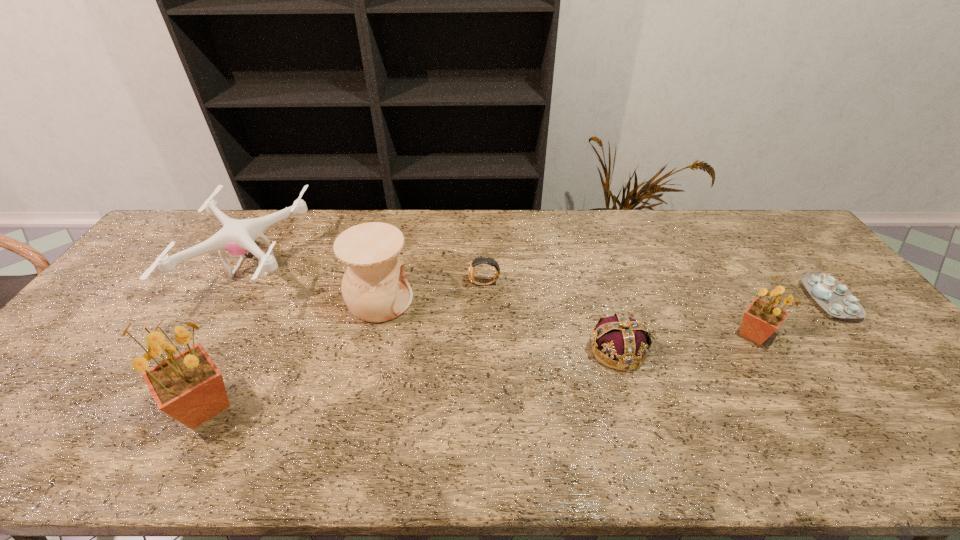
Image resolution: width=960 pixels, height=540 pixels. Identify the location of the fourth object from left to right. (480, 282).

Identify the location of the sixth tallest object. (480, 282).

Where is `free spot located at the front of the tallest object with flowers visible`? free spot located at the front of the tallest object with flowers visible is located at coordinates (306, 407).

The width and height of the screenshot is (960, 540). I want to click on blank area located at the front of the right sunflower with flowers visible, so click(x=794, y=401).

Identify the location of free space located 0.170m on the top of the drone. The width and height of the screenshot is (960, 540). 358,268.

The image size is (960, 540). In order to click on free space located on the left of the rightmost object in this screenshot , I will do `click(670, 300)`.

You are a GUI agent. You are given a task and a screenshot of the screen. Output one action in this format:
    pyautogui.click(x=<x>, y=<y>)
    Task: Click on the free point located at the open side of the fifth object from right to left
    This screenshot has width=960, height=540.
    Given the screenshot: What is the action you would take?
    pyautogui.click(x=471, y=300)

Where is `vacant space situated 0.050m on the back of the crown`? vacant space situated 0.050m on the back of the crown is located at coordinates (607, 315).

Locate an element on the screen. The width and height of the screenshot is (960, 540). vacant region located on the face of the sixth tallest object is located at coordinates (436, 284).

Where is `free space located 0.120m on the face of the sixth tallest object`? Image resolution: width=960 pixels, height=540 pixels. free space located 0.120m on the face of the sixth tallest object is located at coordinates pos(429,284).